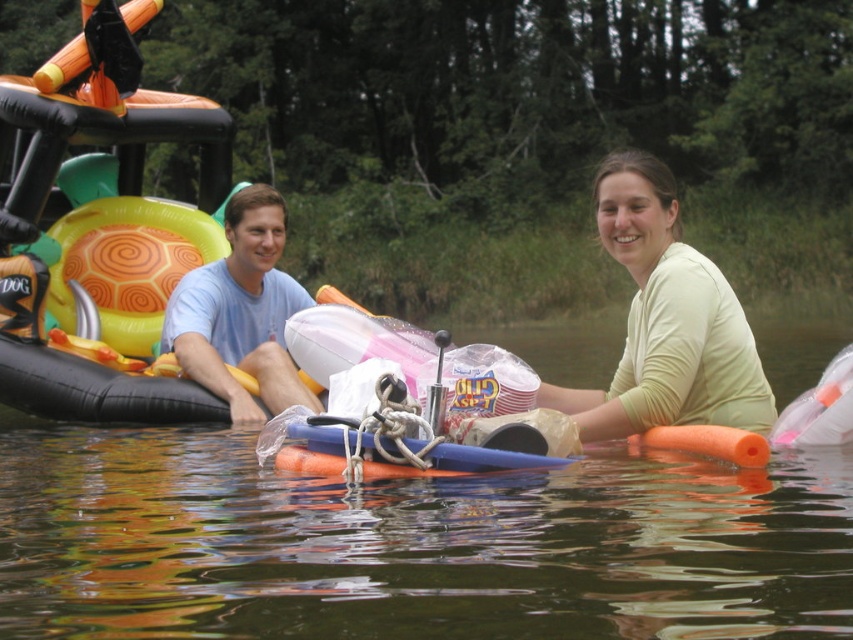
Question: Among these points, which one is farthest from the camera?

Choices:
 (A) (711, 403)
 (B) (248, 268)

Answer: (B)

Question: Does light yellow fabric at center appear under light blue cotton shirt at center?

Choices:
 (A) yes
 (B) no

Answer: (B)

Question: Which point is farther to the camera?

Choices:
 (A) (189, 282)
 (B) (618, 428)

Answer: (A)

Question: Among these objects, which one is nearest to the camera?

Choices:
 (A) light yellow fabric at center
 (B) light blue cotton shirt at center

Answer: (A)

Question: Does light yellow fabric at center appear under light blue cotton shirt at center?

Choices:
 (A) yes
 (B) no

Answer: (B)

Question: Can you confirm if light yellow fabric at center is positioned to the left of light blue cotton shirt at center?

Choices:
 (A) no
 (B) yes

Answer: (A)